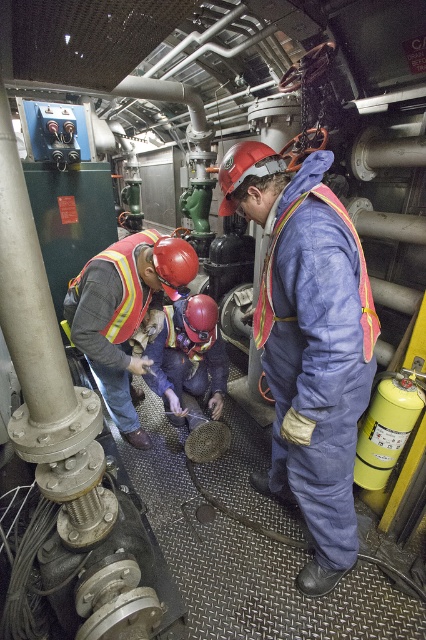
You are a new worker in the utility room. You see the blue coveralls at center and the reflective yellow safety vest at lower left. Which object is closer to the floor?

The blue coveralls at center is below reflective yellow safety vest at lower left, so it is closer to the floor.

You are an inspector in the utility room and need to locate the reflective orange safety vest at center. According to the coordinates provided, where exactly is it positioned?

The reflective orange safety vest at center is located at point (124,312).

You are standing at the point with coordinates point (131, 252) and want to move to the exit door located at point (279, 349). Is the exit door in front of you or behind you?

The point (279, 349) is in front of point (131, 252), so the exit door is in front of you.